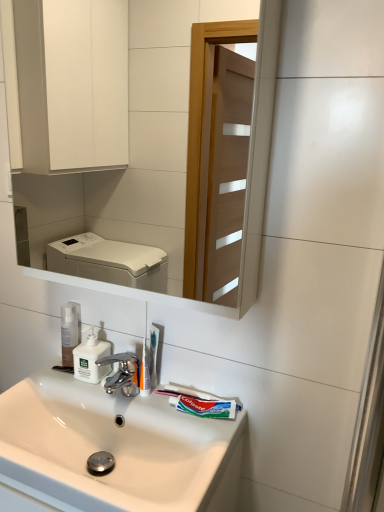
The image size is (384, 512). Identify the location of free location in front of white plastic toothbrush at center, marked as the first toothbrush in a back-to-front arrangement. (169, 415).